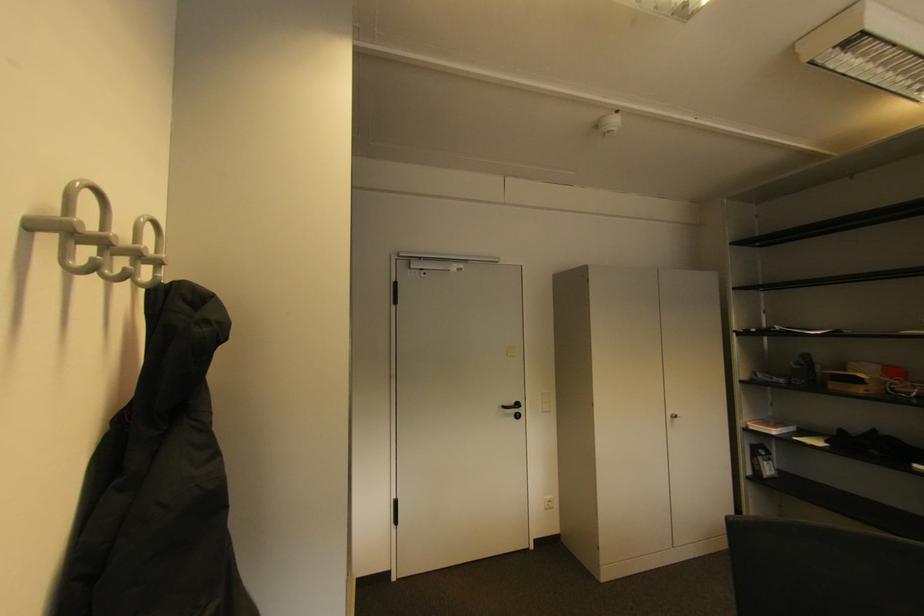
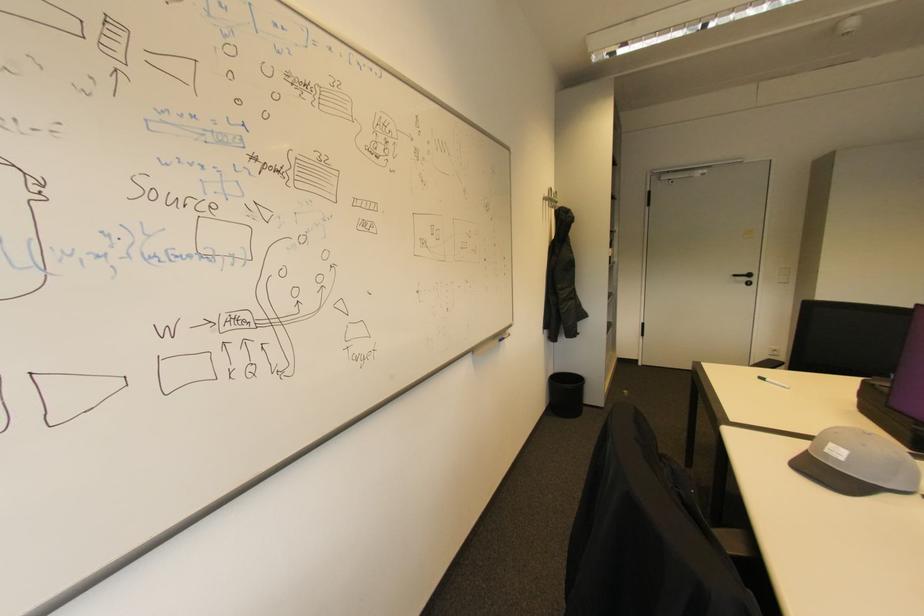
In the second image, find the point that corresponds to (523,406) in the first image.

(755, 276)